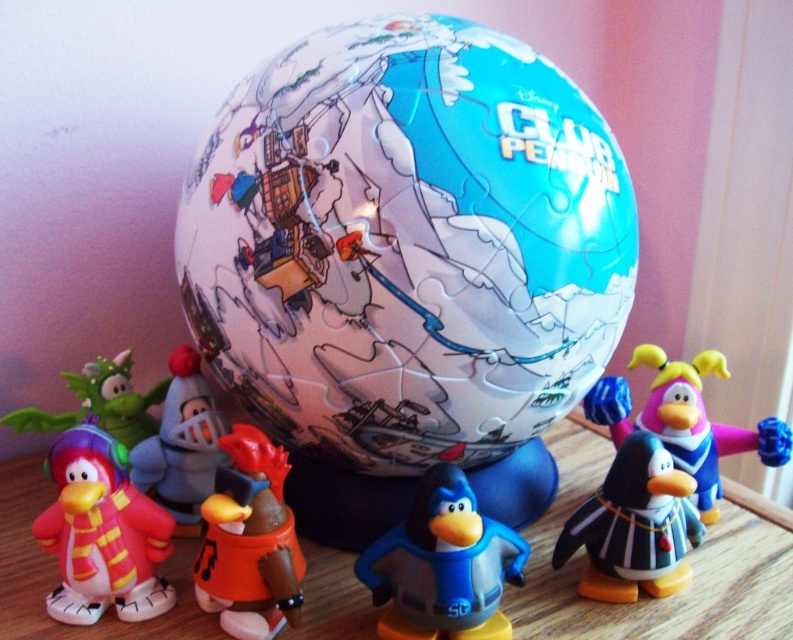
Between matte plastic globe at center and matte green dragon at left, which one appears on the left side from the viewer's perspective?

matte green dragon at left is more to the left.

Where is `matte plastic globe at center`? Image resolution: width=793 pixels, height=640 pixels. matte plastic globe at center is located at coordinates pyautogui.click(x=408, y=262).

Is point (358, 504) farther from viewer compared to point (92, 369)?

No, (358, 504) is in front of (92, 369).

Where is `matte plastic globe at center`? This screenshot has width=793, height=640. matte plastic globe at center is located at coordinates (408, 262).

Does matte plastic globe at center have a greater width compared to orange matte bucket at center?

Yes, matte plastic globe at center is wider than orange matte bucket at center.

Describe the element at coordinates (408, 262) in the screenshot. This screenshot has width=793, height=640. I see `matte plastic globe at center` at that location.

Which is behind, point (569, 268) or point (215, 488)?

The point (215, 488) is more distant.

I want to click on matte plastic globe at center, so coord(408,262).

Find the location of `matte plastic penguin at lower left`. matte plastic penguin at lower left is located at coordinates (102, 532).

Find the location of a particular element. This screenshot has width=793, height=640. matte plastic penguin at lower left is located at coordinates (102, 532).